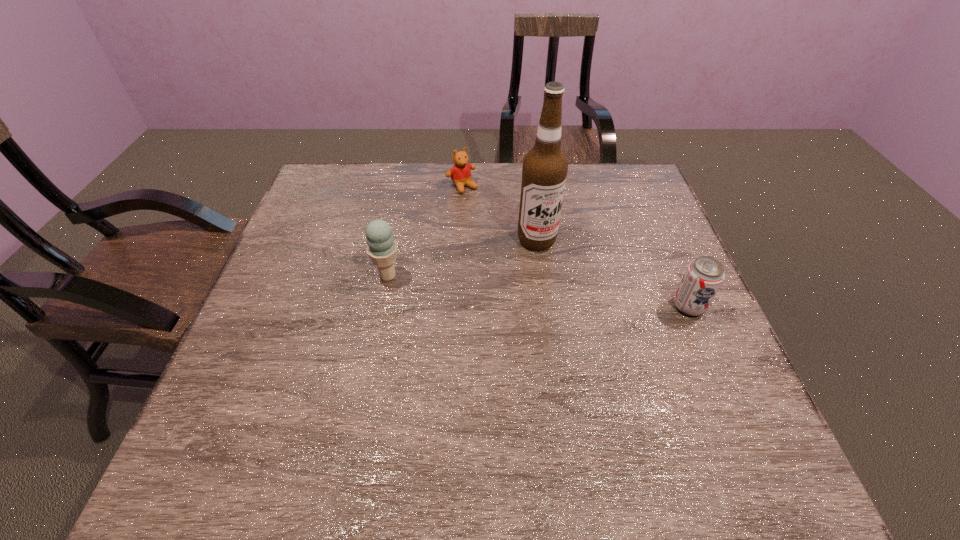
Locate an element on the screen. The height and width of the screenshot is (540, 960). blank region between the leftmost object and the nearest object is located at coordinates (539, 291).

The height and width of the screenshot is (540, 960). What are the coordinates of `vacant space in between the beer can and the second nearest object` in the screenshot? It's located at (539, 291).

Where is `free space between the third farthest object and the rightmost object`? free space between the third farthest object and the rightmost object is located at coordinates (539, 291).

This screenshot has height=540, width=960. What are the coordinates of `vacant point located between the second object from left to right and the third shortest object` in the screenshot? It's located at (425, 231).

At what (x,y) coordinates should I click in order to perform the action: click on the second closest object to the second object from left to right. Please return your answer as a coordinate pair (x, y). The width and height of the screenshot is (960, 540). Looking at the image, I should click on point(381,247).

Locate which object is the third closest to the second object from left to right. Please provide its 2D coordinates. Your answer should be formatted as a tuple, i.e. [(x, y)], where the tuple contains the x and y coordinates of a point satisfying the conditions above.

[(704, 276)]

Find the location of a particular element. The image size is (960, 540). free location that satisfies the following two spatial constraints: 1. on the front side of the nearest object; 2. on the right side of the farthest object is located at coordinates (456, 306).

In order to click on vacant region that satisfies the following two spatial constraints: 1. on the back side of the teddy bear; 2. on the left side of the leftmost object in this screenshot , I will do `click(406, 187)`.

At what (x,y) coordinates should I click in order to perform the action: click on vacant space that satisfies the following two spatial constraints: 1. on the front side of the rightmost object; 2. on the left side of the third shortest object. Please return your answer as a coordinate pair (x, y). Looking at the image, I should click on (381, 306).

At what (x,y) coordinates should I click in order to perform the action: click on vacant point that satisfies the following two spatial constraints: 1. on the back side of the ice cream; 2. on the left side of the alcohol. Please return your answer as a coordinate pair (x, y). This screenshot has height=540, width=960. Looking at the image, I should click on (395, 240).